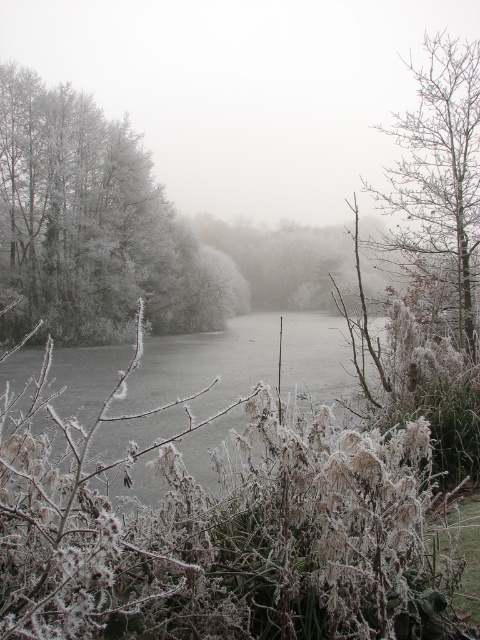
Is frosted white trees at left to the left of frosted ice at center from the viewer's perspective?

Indeed, frosted white trees at left is positioned on the left side of frosted ice at center.

Does point (108, 131) come closer to viewer compared to point (276, 337)?

No, it is not.

Between point (34, 273) and point (154, 364), which one is positioned behind?

The point (34, 273) is more distant.

Identify the location of frosted white trees at left. (92, 225).

Between frosted ice at center and frosty bark tree at right, which one has less height?

frosted ice at center

Find the location of a particular element. The height and width of the screenshot is (640, 480). frosted ice at center is located at coordinates (204, 365).

Between point (326, 337) and point (458, 189), which one is positioned in front?

Point (458, 189)

The image size is (480, 640). In order to click on frosted ice at center in this screenshot , I will do `click(204, 365)`.

Who is higher up, frosted white trees at left or frosty bark tree at right?

frosty bark tree at right

Is frosted white trees at left positioned in front of frosty bark tree at right?

No, frosted white trees at left is behind frosty bark tree at right.

Identify the location of frosted white trees at left. The height and width of the screenshot is (640, 480). (92, 225).

Where is `frosted white trees at left`? The image size is (480, 640). frosted white trees at left is located at coordinates (92, 225).